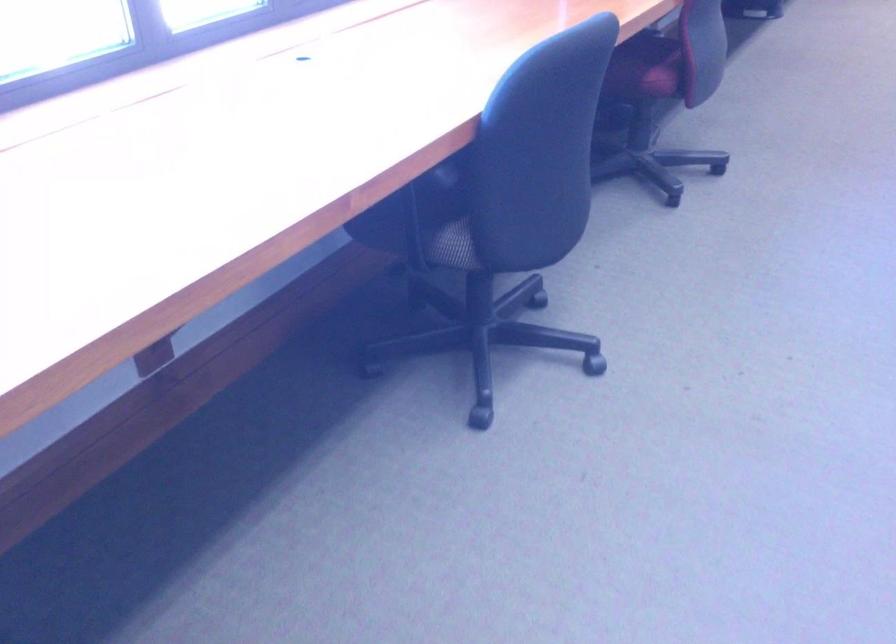
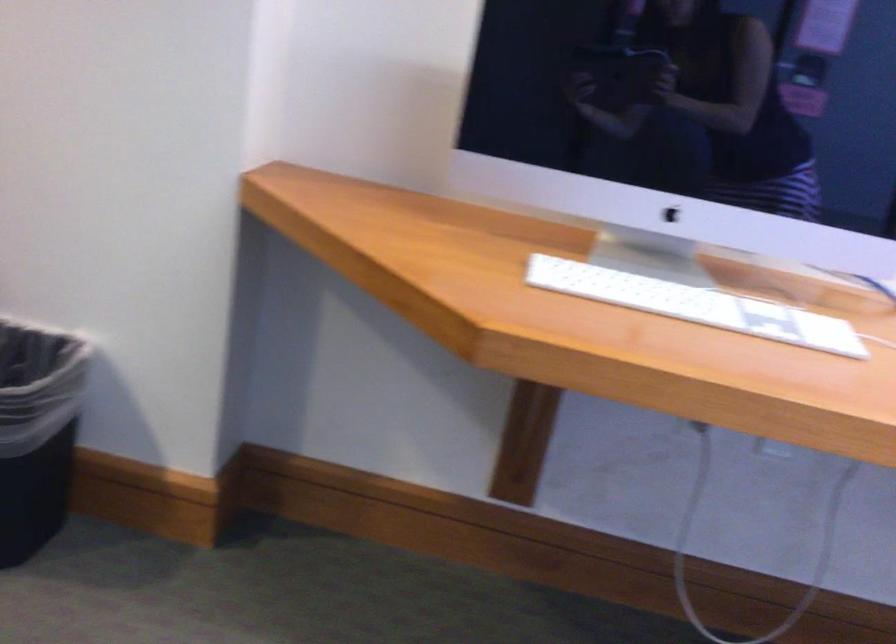
Question: How did the camera likely rotate?

Choices:
 (A) Left
 (B) Right
 (C) Up
 (D) Down

Answer: (A)